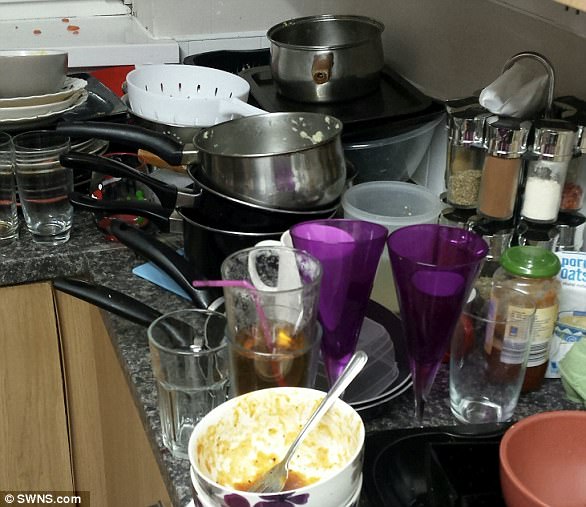
You are a GUI agent. You are given a task and a screenshot of the screen. Output one action in this format:
    pyautogui.click(x=<x>, y=<y>)
    Task: Click on the clear jar of red liquid
    This screenshot has width=586, height=507.
    Given the screenshot: What is the action you would take?
    pyautogui.click(x=543, y=320)